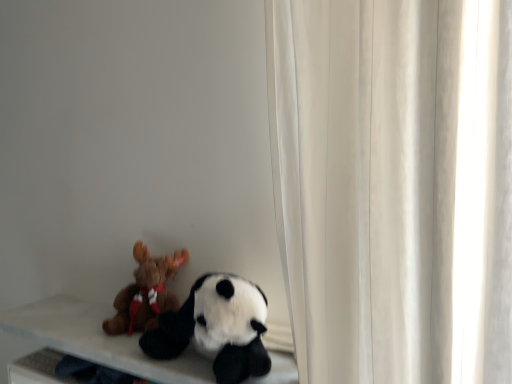
This screenshot has width=512, height=384. Describe the element at coordinates (100, 340) in the screenshot. I see `soft white table at lower left` at that location.

What do you see at coordinates (217, 327) in the screenshot? The image size is (512, 384). I see `soft plush panda at lower left, placed as the 2th toy when sorted from left to right` at bounding box center [217, 327].

The width and height of the screenshot is (512, 384). Identify the location of soft white table at lower left. (100, 340).

Would you say brown plush moose at left, the 2th toy when ordered from right to left, is inside or outside soft white table at lower left?

brown plush moose at left, the 2th toy when ordered from right to left, cannot be found inside soft white table at lower left.

From the image's perspective, is brown plush moose at left, arranged as the 1th toy when viewed from the left, located beneath soft white table at lower left?

No, from the image's perspective, brown plush moose at left, arranged as the 1th toy when viewed from the left, is not below soft white table at lower left.

Is brown plush moose at left, arranged as the 1th toy when viewed from the left, oriented towards soft white table at lower left?

No.

Is the depth of brown plush moose at left, arranged as the 1th toy when viewed from the left, less than that of soft white table at lower left?

No, it is behind soft white table at lower left.

Could you tell me if soft white table at lower left is facing soft plush panda at lower left, placed as the 2th toy when sorted from left to right?

No, soft white table at lower left is not oriented towards soft plush panda at lower left, placed as the 2th toy when sorted from left to right.

Considering the positions of objects soft white table at lower left and soft plush panda at lower left, placed as the 2th toy when sorted from left to right, in the image provided, who is in front, soft white table at lower left or soft plush panda at lower left, placed as the 2th toy when sorted from left to right,?

soft plush panda at lower left, placed as the 2th toy when sorted from left to right, is closer to the camera.

Considering the points (130, 354) and (225, 371), which point is behind, point (130, 354) or point (225, 371)?

The point (130, 354) is farther.

Considering the relative positions of soft white table at lower left and soft plush panda at lower left, placed as the 2th toy when sorted from left to right, in the image provided, is soft white table at lower left to the right of soft plush panda at lower left, placed as the 2th toy when sorted from left to right, from the viewer's perspective?

Incorrect, soft white table at lower left is not on the right side of soft plush panda at lower left, placed as the 2th toy when sorted from left to right.

From their relative heights in the image, would you say brown plush moose at left, the 2th toy when ordered from right to left, is taller or shorter than soft plush panda at lower left, placed as the 2th toy when sorted from left to right?

Considering their sizes, brown plush moose at left, the 2th toy when ordered from right to left, has less height than soft plush panda at lower left, placed as the 2th toy when sorted from left to right.

Is brown plush moose at left, arranged as the 1th toy when viewed from the left, placed right next to soft plush panda at lower left, placed as the 2th toy when sorted from left to right?

brown plush moose at left, arranged as the 1th toy when viewed from the left, and soft plush panda at lower left, placed as the 2th toy when sorted from left to right, are not in contact.

Find the location of `toy that is on the right side of brown plush moose at left, arranged as the 1th toy when viewed from the left`. toy that is on the right side of brown plush moose at left, arranged as the 1th toy when viewed from the left is located at coordinates click(x=217, y=327).

Is brown plush moose at left, arranged as the 1th toy when viewed from the left, closer to the viewer compared to soft plush panda at lower left, placed as the 2th toy when sorted from left to right?

No, the depth of brown plush moose at left, arranged as the 1th toy when viewed from the left, is greater than that of soft plush panda at lower left, placed as the 2th toy when sorted from left to right.

Can you confirm if soft plush panda at lower left, placed as the 2th toy when sorted from left to right, is bigger than soft white table at lower left?

No, soft plush panda at lower left, placed as the 2th toy when sorted from left to right, is not bigger than soft white table at lower left.

Is soft plush panda at lower left, arranged as the first toy when viewed from the right, positioned with its back to soft white table at lower left?

No, soft plush panda at lower left, arranged as the first toy when viewed from the right,'s orientation is not away from soft white table at lower left.

Considering the sizes of objects soft plush panda at lower left, arranged as the first toy when viewed from the right, and soft white table at lower left in the image provided, who is shorter, soft plush panda at lower left, arranged as the first toy when viewed from the right, or soft white table at lower left?

soft white table at lower left.

How many degrees apart are the facing directions of soft plush panda at lower left, arranged as the first toy when viewed from the right, and soft white table at lower left?

0.0923 degrees separate the facing orientations of soft plush panda at lower left, arranged as the first toy when viewed from the right, and soft white table at lower left.

Does point (218, 278) come behind point (154, 297)?

No, it is not.

Does soft plush panda at lower left, arranged as the first toy when viewed from the right, have a smaller size compared to brown plush moose at left, the 2th toy when ordered from right to left?

Incorrect, soft plush panda at lower left, arranged as the first toy when viewed from the right, is not smaller in size than brown plush moose at left, the 2th toy when ordered from right to left.

Can we say soft plush panda at lower left, placed as the 2th toy when sorted from left to right, lies outside brown plush moose at left, the 2th toy when ordered from right to left?

That's correct, soft plush panda at lower left, placed as the 2th toy when sorted from left to right, is outside of brown plush moose at left, the 2th toy when ordered from right to left.

Is soft white table at lower left beside brown plush moose at left, arranged as the 1th toy when viewed from the left?

No, soft white table at lower left is not in contact with brown plush moose at left, arranged as the 1th toy when viewed from the left.

Measure the distance between soft white table at lower left and brown plush moose at left, arranged as the 1th toy when viewed from the left.

soft white table at lower left is 5.08 inches from brown plush moose at left, arranged as the 1th toy when viewed from the left.

Which object is further away from the camera taking this photo, soft white table at lower left or brown plush moose at left, the 2th toy when ordered from right to left?

brown plush moose at left, the 2th toy when ordered from right to left, is more distant.

Can you confirm if soft white table at lower left is positioned to the left of brown plush moose at left, the 2th toy when ordered from right to left?

Yes, soft white table at lower left is to the left of brown plush moose at left, the 2th toy when ordered from right to left.

Where is `table on the left of brown plush moose at left, the 2th toy when ordered from right to left`? table on the left of brown plush moose at left, the 2th toy when ordered from right to left is located at coordinates (100, 340).

In order to click on toy that is in front of the soft white table at lower left in this screenshot , I will do `click(217, 327)`.

Estimate the real-world distances between objects in this image. Which object is closer to soft plush panda at lower left, placed as the 2th toy when sorted from left to right, soft white table at lower left or brown plush moose at left, arranged as the 1th toy when viewed from the left?

Based on the image, soft white table at lower left appears to be nearer to soft plush panda at lower left, placed as the 2th toy when sorted from left to right.

Looking at the image, which one is located closer to soft plush panda at lower left, placed as the 2th toy when sorted from left to right, brown plush moose at left, arranged as the 1th toy when viewed from the left, or soft white table at lower left?

Based on the image, soft white table at lower left appears to be nearer to soft plush panda at lower left, placed as the 2th toy when sorted from left to right.

Estimate the real-world distances between objects in this image. Which object is closer to soft white table at lower left, soft plush panda at lower left, arranged as the first toy when viewed from the right, or brown plush moose at left, arranged as the 1th toy when viewed from the left?

The object closer to soft white table at lower left is brown plush moose at left, arranged as the 1th toy when viewed from the left.

Considering their positions, is soft plush panda at lower left, placed as the 2th toy when sorted from left to right, positioned further to brown plush moose at left, arranged as the 1th toy when viewed from the left, than soft white table at lower left?

The object further to brown plush moose at left, arranged as the 1th toy when viewed from the left, is soft plush panda at lower left, placed as the 2th toy when sorted from left to right.

When comparing their distances from soft white table at lower left, does brown plush moose at left, arranged as the 1th toy when viewed from the left, or soft plush panda at lower left, arranged as the first toy when viewed from the right, seem further?

soft plush panda at lower left, arranged as the first toy when viewed from the right.

Considering their positions, is soft white table at lower left positioned further to brown plush moose at left, the 2th toy when ordered from right to left, than soft plush panda at lower left, arranged as the first toy when viewed from the right?

Based on the image, soft plush panda at lower left, arranged as the first toy when viewed from the right, appears to be further to brown plush moose at left, the 2th toy when ordered from right to left.

Locate an element on the screen. The height and width of the screenshot is (384, 512). table between soft plush panda at lower left, arranged as the first toy when viewed from the right, and brown plush moose at left, the 2th toy when ordered from right to left, along the z-axis is located at coordinates (100, 340).